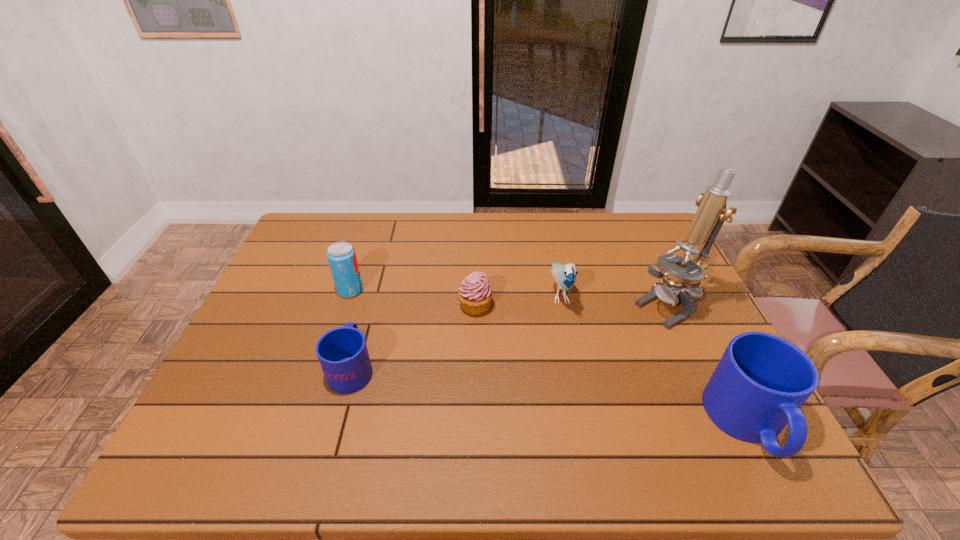
The image size is (960, 540). Find the location of `the shorter mug`. the shorter mug is located at coordinates (342, 352).

What are the coordinates of `the right mug` in the screenshot? It's located at (761, 381).

Identify the location of cupcake. The width and height of the screenshot is (960, 540). (475, 294).

Find the location of a particular element. The image size is (960, 540). soda can is located at coordinates (341, 256).

Locate an element on the screen. The height and width of the screenshot is (540, 960). bird is located at coordinates (564, 276).

At what (x,y) coordinates should I click in order to perform the action: click on the tallest object. Please return your answer as a coordinate pair (x, y). Looking at the image, I should click on (711, 213).

Identify the location of vacant space located on the side with the handle of the left mug. This screenshot has width=960, height=540. (379, 266).

The width and height of the screenshot is (960, 540). I want to click on vacant space located 0.390m on the side with the handle of the left mug, so coord(384,251).

I want to click on blank space located 0.340m on the side with the handle of the left mug, so click(381, 260).

Identify the location of vacant space located 0.240m on the right of the cupcake. Image resolution: width=960 pixels, height=540 pixels. tap(579, 306).